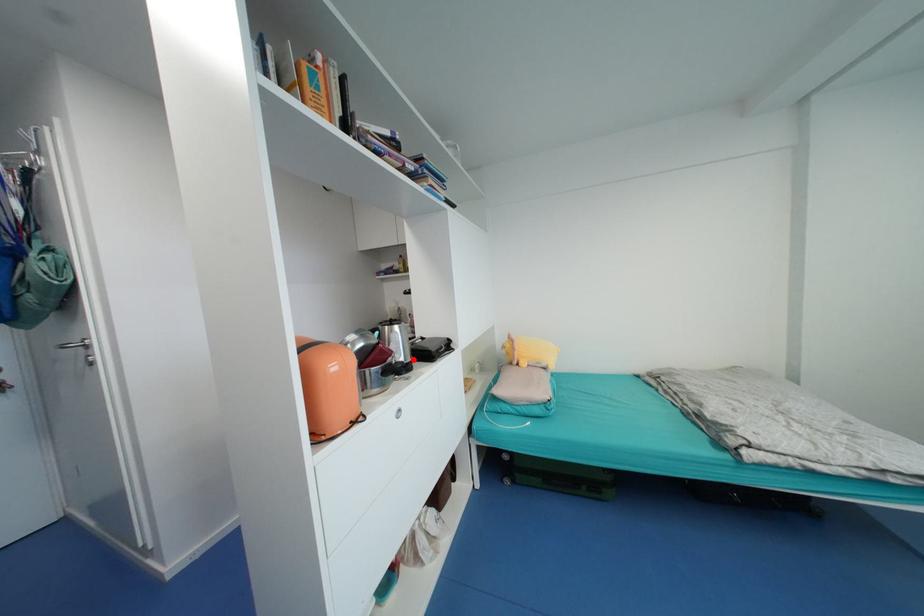
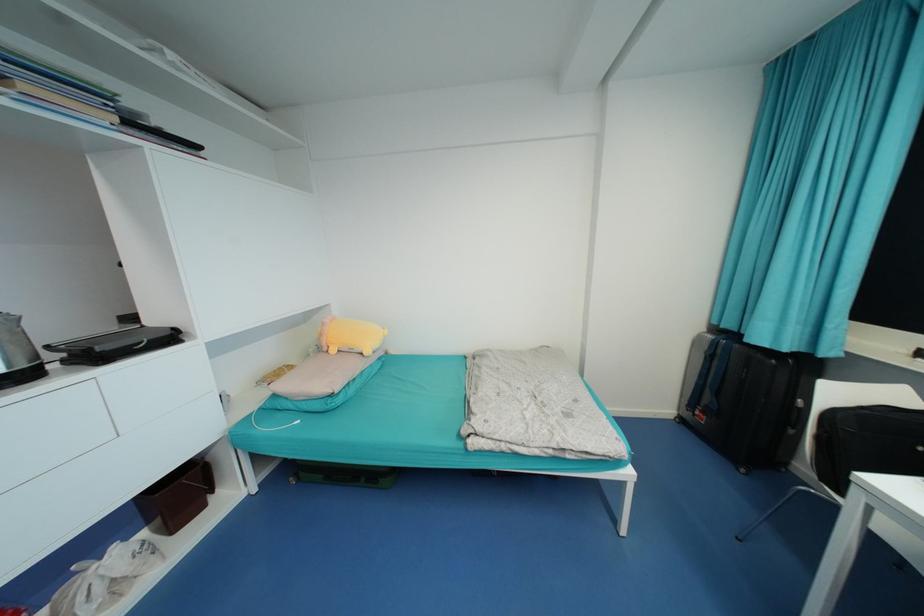
Find the pixel in the second image that matches the highlighted location in the first image.

(30, 367)